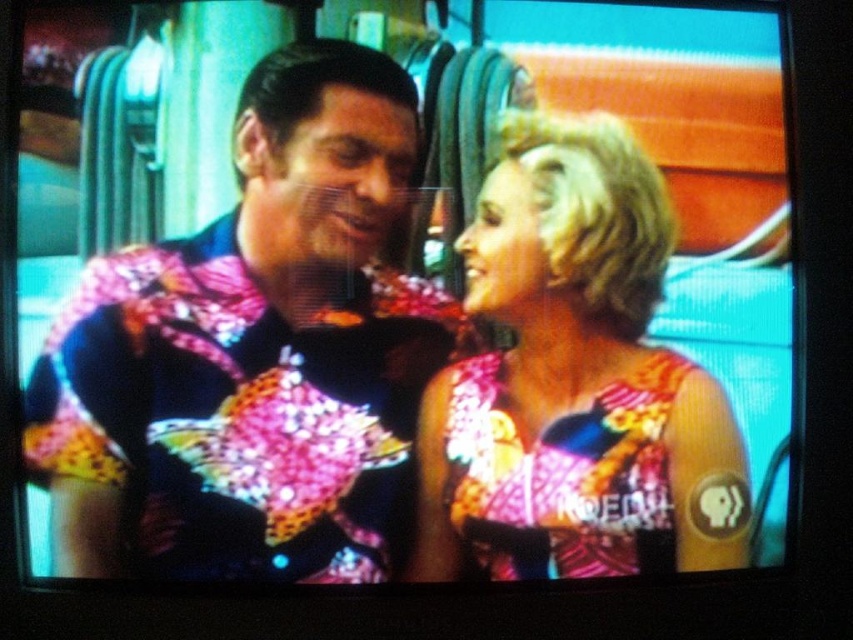
Which is in front, point (340, 156) or point (450, 561)?

Point (340, 156) is in front.

Which is in front, point (190, 285) or point (485, 388)?

Positioned in front is point (190, 285).

Image resolution: width=853 pixels, height=640 pixels. I want to click on shiny sequined shirt at center, so click(254, 355).